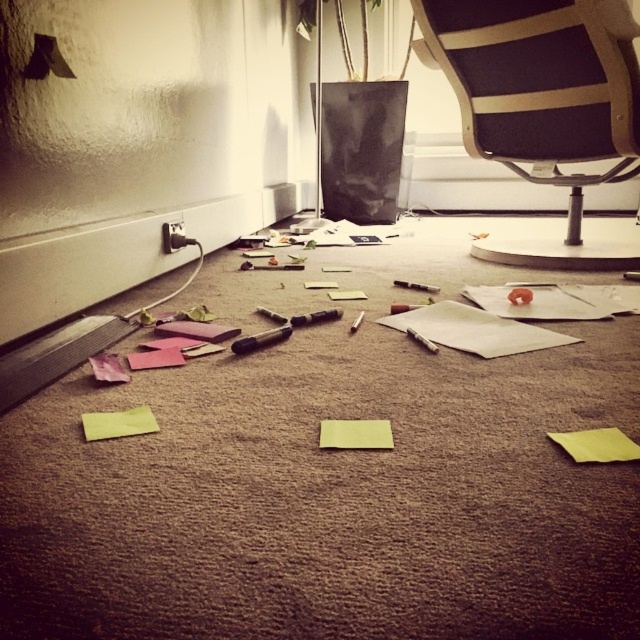
Is black mesh swivel chair at upper right positioned at the back of black plastic screwdriver at center?

Yes, black mesh swivel chair at upper right is behind black plastic screwdriver at center.

Can you confirm if black mesh swivel chair at upper right is positioned to the right of black plastic screwdriver at center?

Yes, black mesh swivel chair at upper right is to the right of black plastic screwdriver at center.

Image resolution: width=640 pixels, height=640 pixels. I want to click on black mesh swivel chair at upper right, so click(x=540, y=84).

Can you confirm if black mesh swivel chair at upper right is positioned below yellow matte sticky note at center?

Actually, black mesh swivel chair at upper right is above yellow matte sticky note at center.

Between point (525, 148) and point (321, 436), which one is positioned in front?

Point (321, 436)

Which is behind, point (545, 246) or point (342, 433)?

Positioned behind is point (545, 246).

Where is `black mesh swivel chair at upper right`? The height and width of the screenshot is (640, 640). black mesh swivel chair at upper right is located at coordinates (540, 84).

Does black mesh swivel chair at upper right have a larger size compared to yellow matte sticky note at lower right?

Yes, black mesh swivel chair at upper right is bigger than yellow matte sticky note at lower right.

Between point (556, 58) and point (586, 429), which one is positioned behind?

The point (556, 58) is behind.

I want to click on black mesh swivel chair at upper right, so click(540, 84).